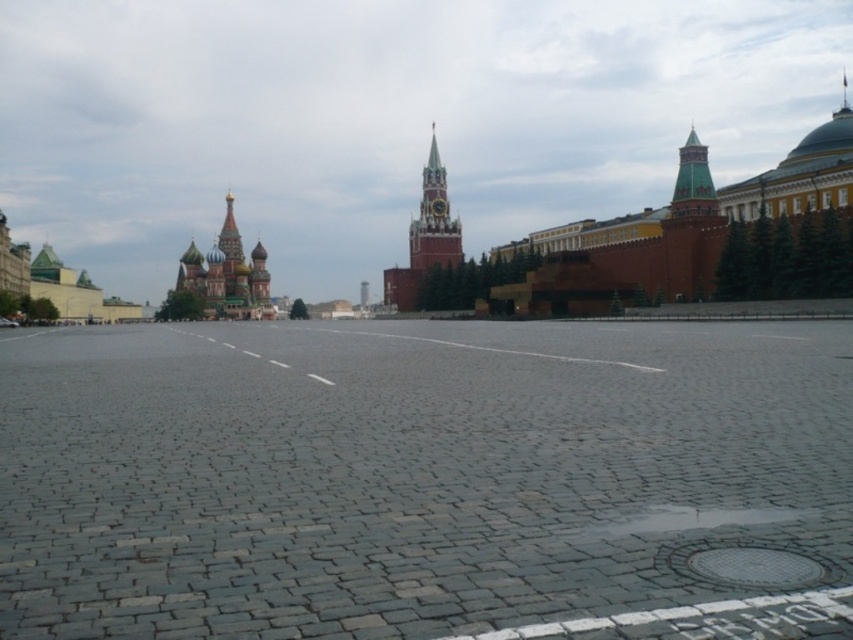
Question: Among these objects, which one is farthest from the camera?

Choices:
 (A) green copper tower at upper right
 (B) golden domed tower at upper left
 (C) shiny gold onion dome at center-left

Answer: (B)

Question: Which point appears closest to the camera in this image?

Choices:
 (A) (238, 257)
 (B) (421, 234)
 (C) (697, 186)

Answer: (C)

Question: Is smooth stone clock tower at center wider than green copper tower at upper right?

Choices:
 (A) yes
 (B) no

Answer: (A)

Question: Is shiny gold onion dome at center-left to the left of golden domed tower at upper left from the viewer's perspective?

Choices:
 (A) yes
 (B) no

Answer: (B)

Question: Which point is closer to the camera taking this photo?

Choices:
 (A) (241, 241)
 (B) (691, 205)
 (C) (247, 285)

Answer: (B)

Question: Does smooth stone clock tower at center have a greater width compared to green copper tower at upper right?

Choices:
 (A) no
 (B) yes

Answer: (B)